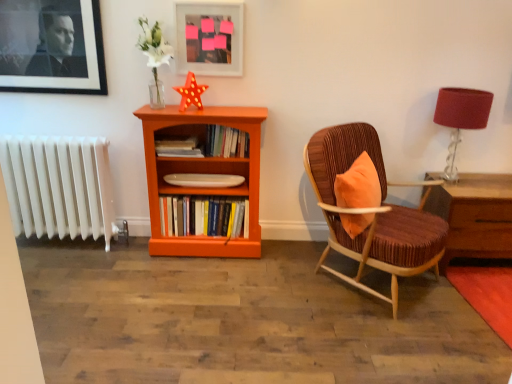
The height and width of the screenshot is (384, 512). In order to click on free area below white plastic radiator at left (from a real-world perspective) in this screenshot , I will do `click(68, 249)`.